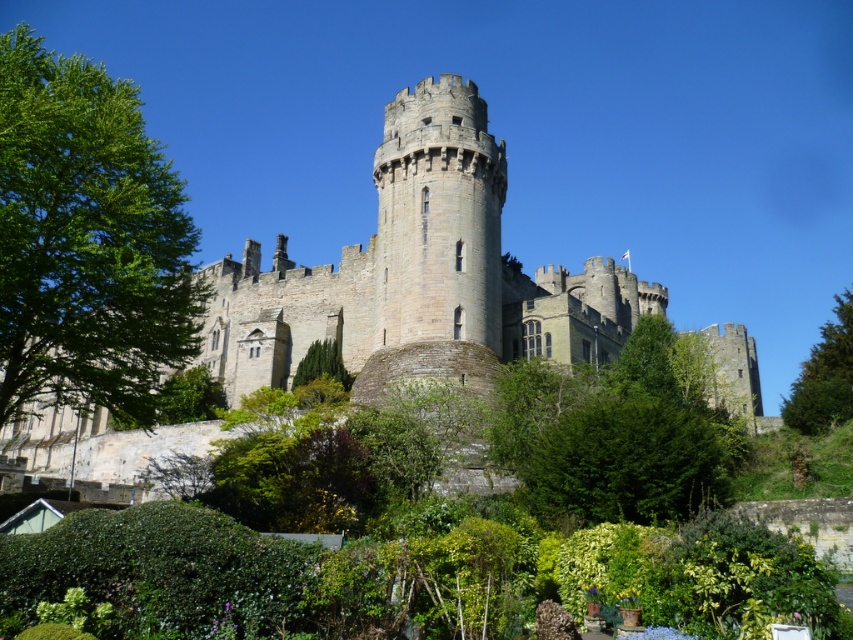
You are standing at the base of the medieval castle looking towards the central tower. You notice two points marked on the image. The first point is located at coordinates point (173, 230) and the second at point (310, 380). From your perspective, which point appears closer to you?

Point (173, 230) is in front of point (310, 380), so it appears closer to you.

You are a bird flying over the medieval castle. You notice two trees in the foreground. Which tree, the green leafy tree at left or the green textured tree at center, is positioned higher relative to the other?

The green leafy tree at left is positioned higher than the green textured tree at center.